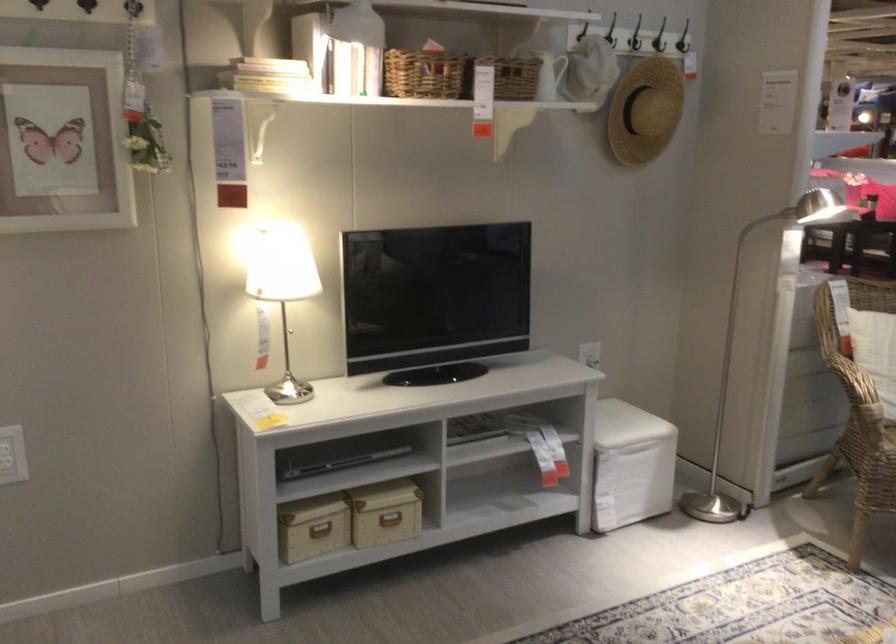
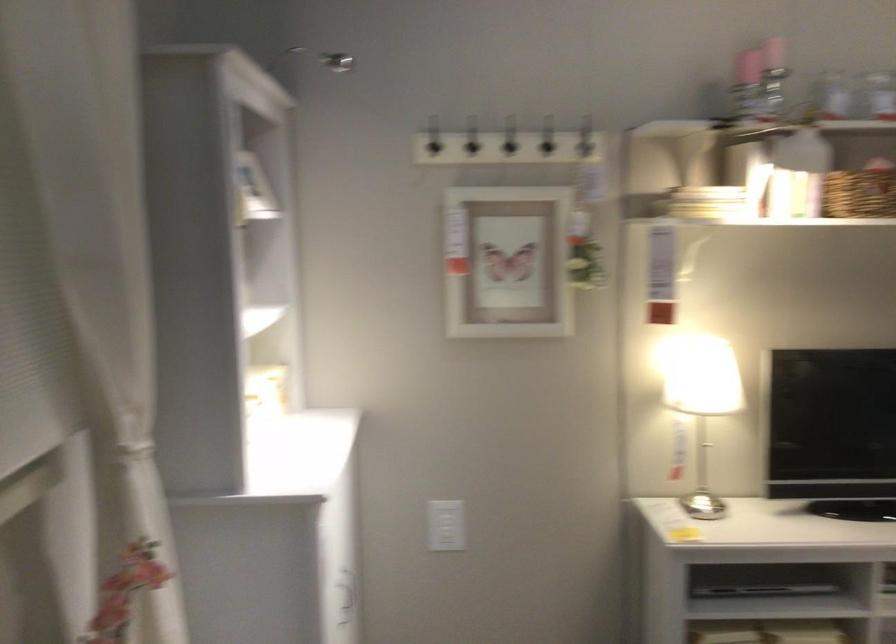
The point at (406, 82) is marked in the first image. Where is the corresponding point in the second image?

(859, 192)